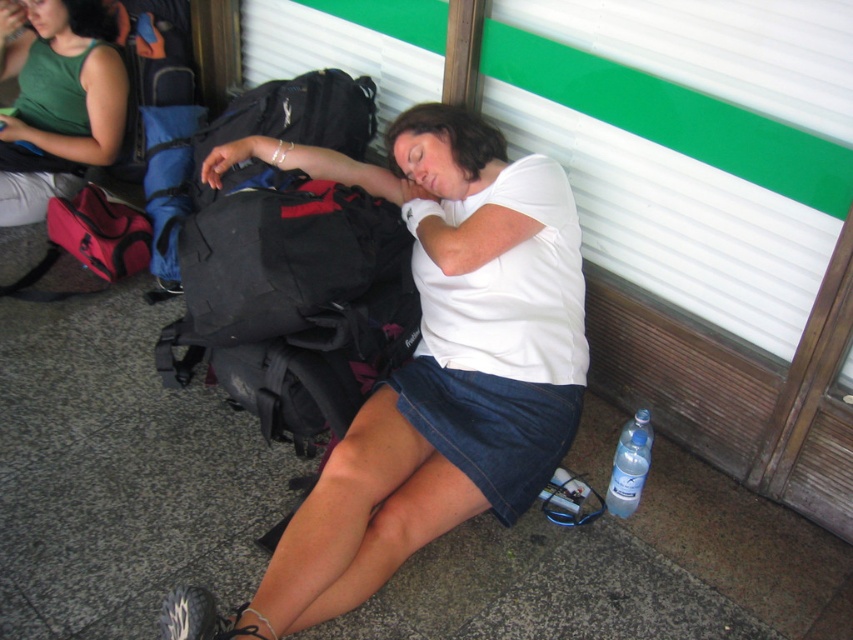
You are a pedestrian passing by the denim skirt at lower center and the clear plastic bottle at lower right. Which object is closer to you?

The denim skirt at lower center is closer to you because it is in front of the clear plastic bottle at lower right.

You are standing at the public transportation hub and want to place a small item between the two points labeled as point (500,198) and point (497,381). Which point should you place the item closer to in order for it to be in front of the other point?

You should place the item closer to point (497,381) because point (500,198) is behind point (497,381), so placing it near the front point keeps it visible.